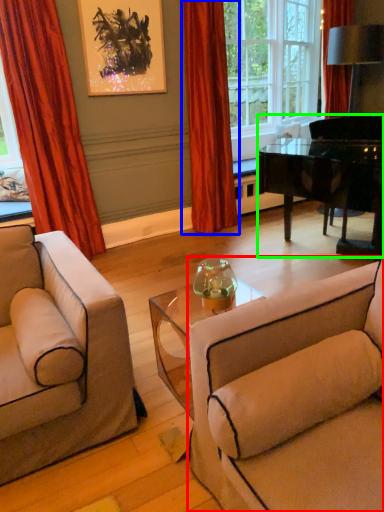
Question: Estimate the real-world distances between objects in this image. Which object is closer to studio couch (highlighted by a red box), curtain (highlighted by a blue box) or piano (highlighted by a green box)?

Choices:
 (A) curtain
 (B) piano

Answer: (B)